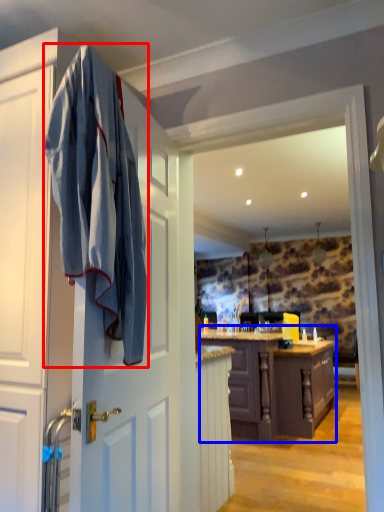
Question: Which object is closer to the camera taking this photo, bath towel (highlighted by a red box) or cabinetry (highlighted by a blue box)?

Choices:
 (A) bath towel
 (B) cabinetry

Answer: (A)